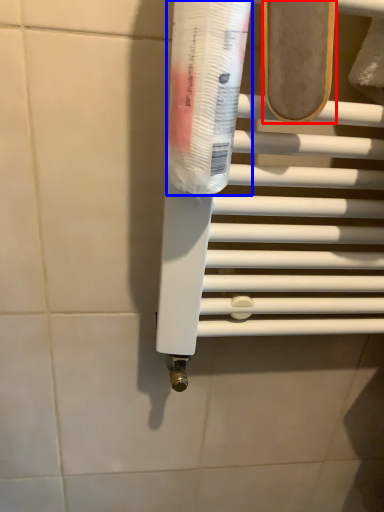
Question: Which object is closer to the camera taking this photo, footwear (highlighted by a red box) or toothpaste (highlighted by a blue box)?

Choices:
 (A) footwear
 (B) toothpaste

Answer: (B)